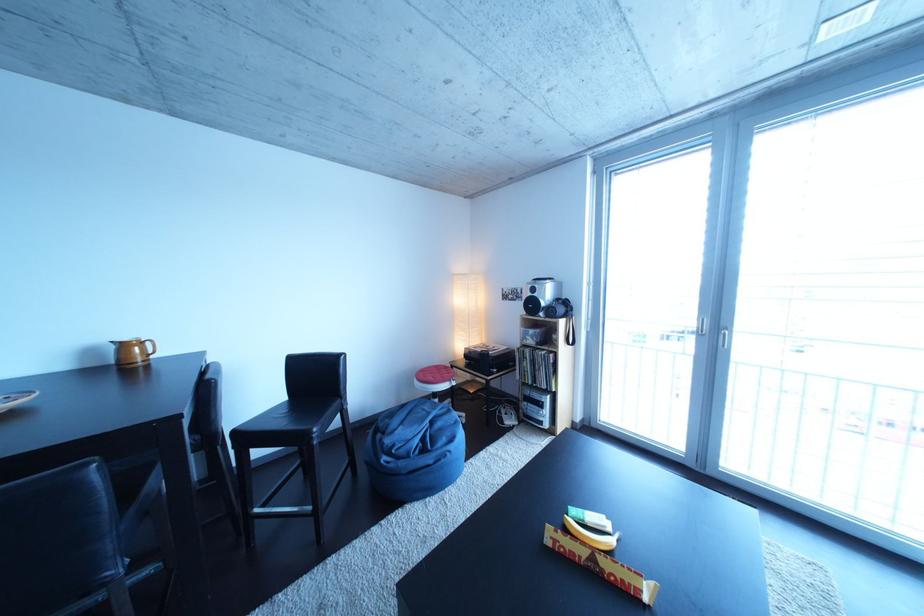
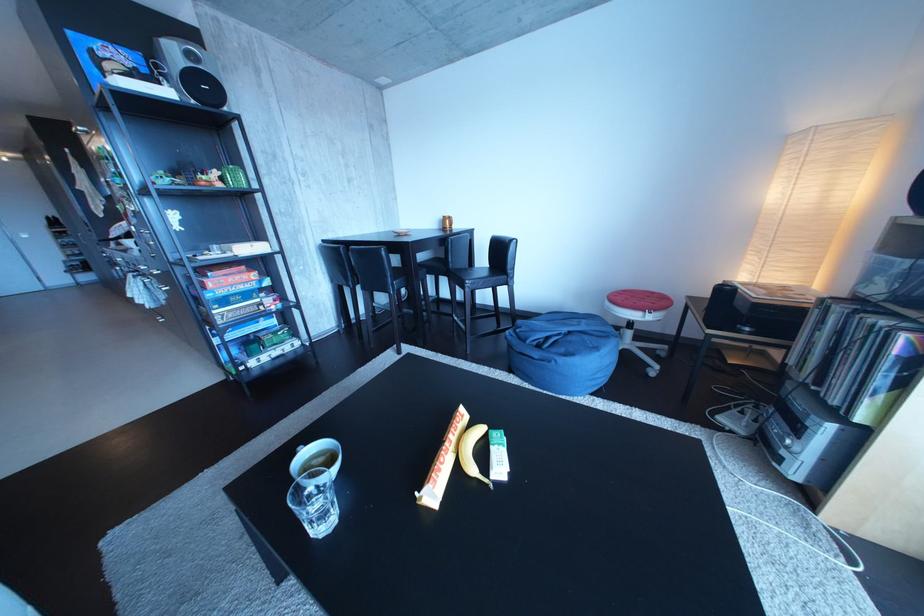
The point at (556, 359) is marked in the first image. Where is the corresponding point in the second image?

(896, 328)